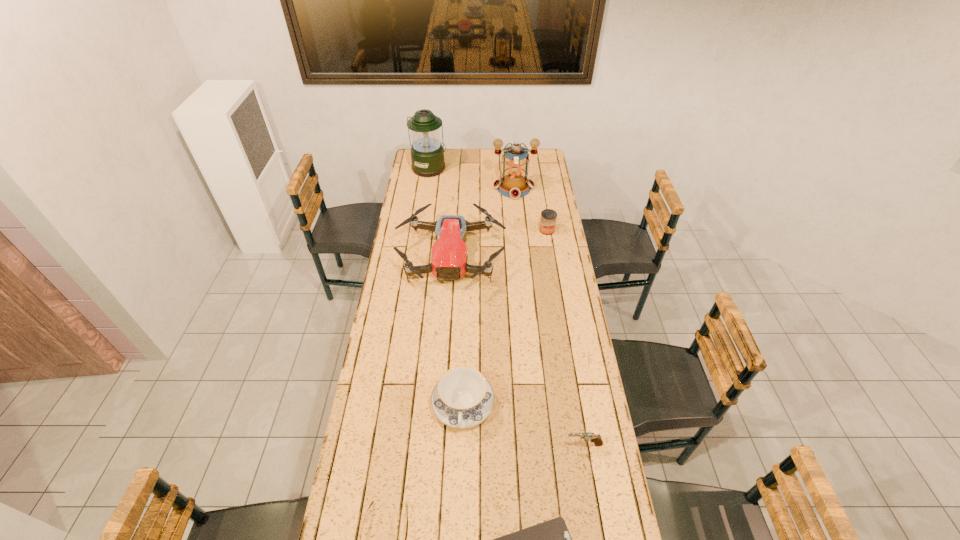
Locate an element on the screen. The image size is (960, 540). free space located with the handle on the side of the fifth farthest object is located at coordinates (460, 515).

At what (x,y) coordinates should I click in order to perform the action: click on vacant space located on the left of the can. Please return your answer as a coordinate pair (x, y). Image resolution: width=960 pixels, height=540 pixels. Looking at the image, I should click on (527, 230).

At what (x,y) coordinates should I click in order to perform the action: click on free space located at the barrel of the sixth tallest object. Please return your answer as a coordinate pair (x, y). This screenshot has width=960, height=540. Looking at the image, I should click on (514, 444).

The height and width of the screenshot is (540, 960). What are the coordinates of `free point located at the barrel of the sixth tallest object` in the screenshot? It's located at (514, 444).

The height and width of the screenshot is (540, 960). I want to click on vacant space located 0.290m at the barrel of the sixth tallest object, so click(x=476, y=444).

The height and width of the screenshot is (540, 960). In order to click on object at the far edge in this screenshot , I will do `click(427, 153)`.

At what (x,y) coordinates should I click in order to perform the action: click on lantern that is at the left edge. Please return your answer as a coordinate pair (x, y). Looking at the image, I should click on (427, 153).

Find the location of a particular element. Image resolution: width=960 pixels, height=540 pixels. drone present at the left edge is located at coordinates (449, 256).

Locate an element on the screen. This screenshot has width=960, height=540. lantern that is at the right edge is located at coordinates coord(514,184).

Locate an element on the screen. The width and height of the screenshot is (960, 540). can situated at the right edge is located at coordinates (548, 218).